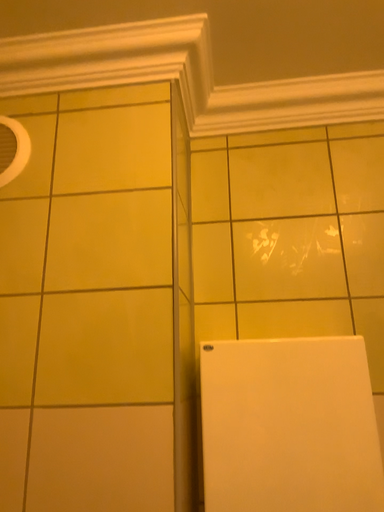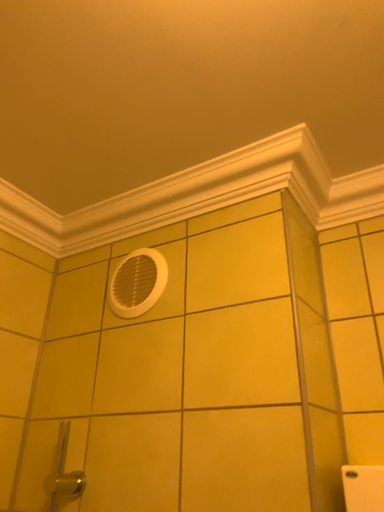
Question: How did the camera likely rotate when shooting the video?

Choices:
 (A) rotated upward
 (B) rotated downward

Answer: (A)